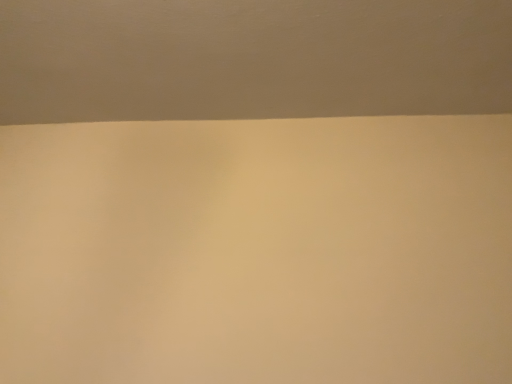
The image size is (512, 384). I want to click on smooth beige wall at upper center, so click(x=251, y=59).

Describe the element at coordinates (251, 59) in the screenshot. I see `smooth beige wall at upper center` at that location.

This screenshot has height=384, width=512. What are the coordinates of `smooth beige wall at upper center` in the screenshot? It's located at (251, 59).